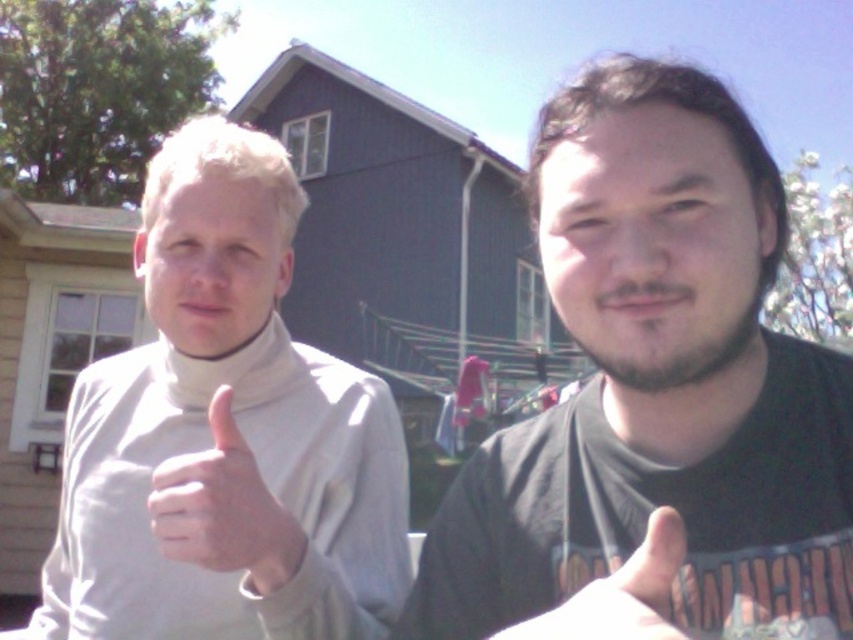
You are a fashion designer who wants to see the light gray turtleneck sweater at left in the image. Where exactly should you look?

The light gray turtleneck sweater at left is located at point (224,435).

You are standing in front of the house and want to reach a point that is exactly at coordinates point [177,314]. If your maximum comfortable reaching distance is 30 inches, can you comfortably reach that point without moving closer?

The distance of point [177,314] from viewer is 33.10 inches, which exceeds your maximum comfortable reaching distance of 30 inches. Therefore, you cannot comfortably reach that point without moving closer.

You are a photographer setting up for a family photo. You notice the black matte shirt at right and the white matte hand at center in the scene. Which object is covering part of the other?

The black matte shirt at right is positioned over the white matte hand at center, so it is covering part of it.